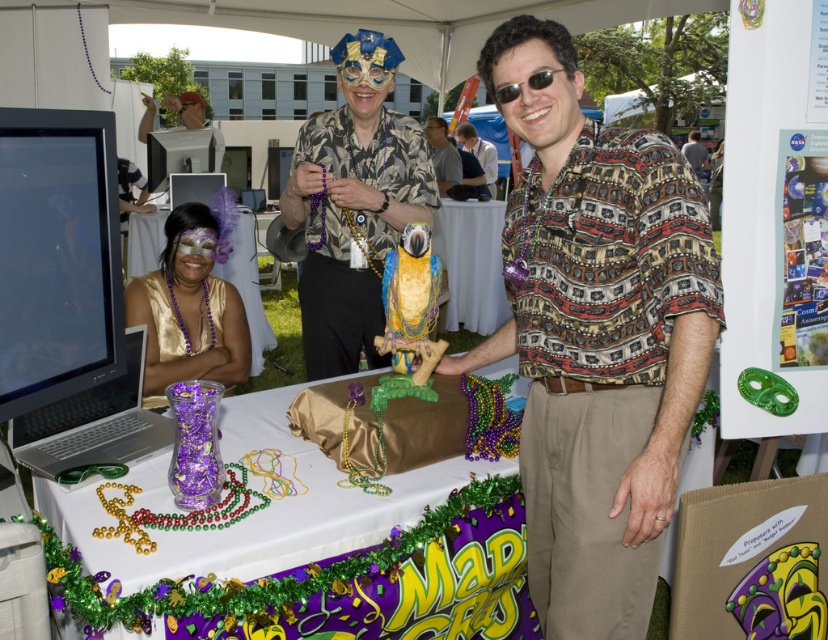
Question: Which object appears closest to the camera in this image?

Choices:
 (A) sunglasses at center
 (B) matte black mask at upper center

Answer: (A)

Question: Which of the following is the closest to the observer?

Choices:
 (A) purple satin mask at center
 (B) matte black mask at upper left

Answer: (A)

Question: Observing the image, what is the correct spatial positioning of matte gold mask at center in reference to matte black mask at upper center?

Choices:
 (A) left
 (B) right

Answer: (A)

Question: Among these objects, which one is nearest to the camera?

Choices:
 (A) purple satin mask at center
 (B) printed cotton shirt at center

Answer: (B)

Question: Is white fabric tablecloth at center closer to the viewer compared to metallic gold mask at upper center?

Choices:
 (A) no
 (B) yes

Answer: (B)

Question: Is printed cotton shirt at center further to camera compared to sunglasses at center?

Choices:
 (A) yes
 (B) no

Answer: (B)